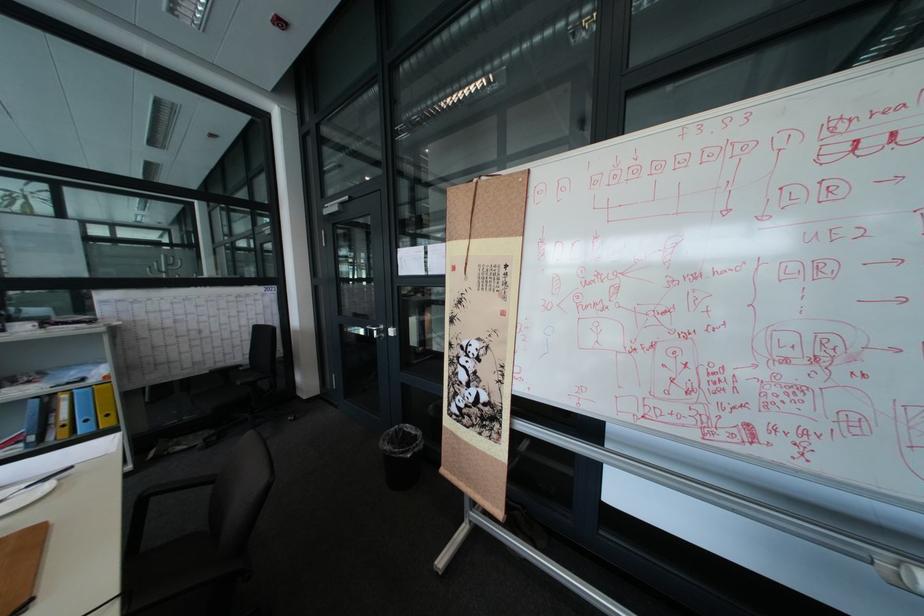
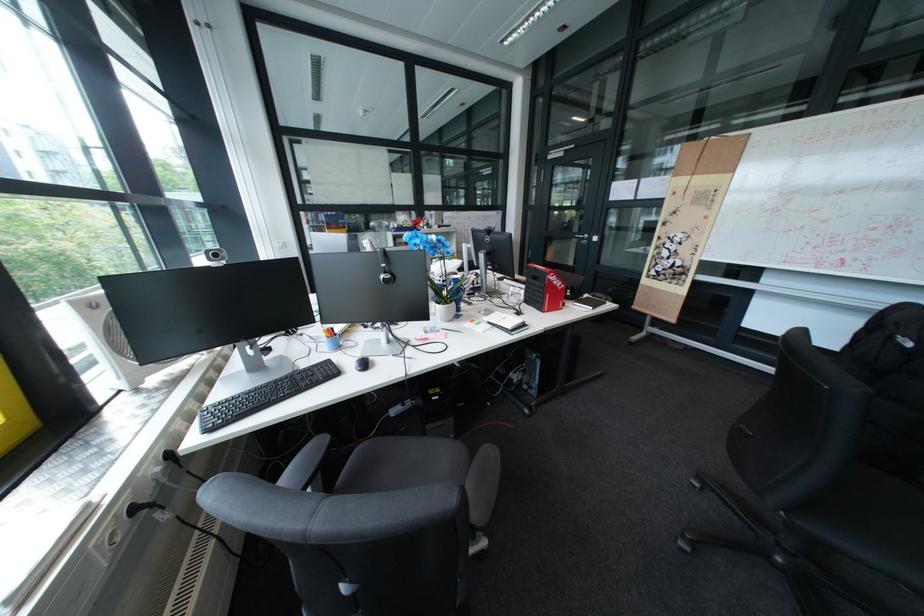
Question: I am providing you with two images of the same scene from different viewpoints. Which of the following objects are not visible in image2?

Choices:
 (A) blue pencil holder
 (B) black computer mouse
 (C) grey chair sitting surface
 (D) none of these

Answer: (D)